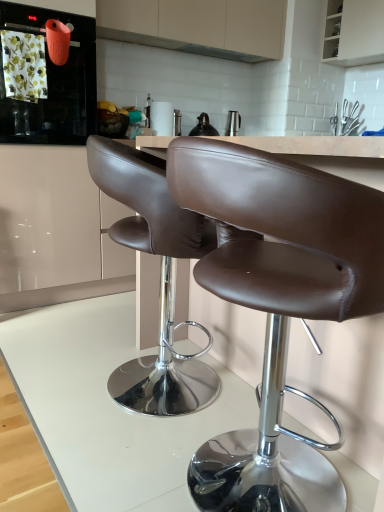
Question: Is brown leather chair at center, the 1th chair from the front, completely or partially inside metallic silver exhaust hood at upper center?

Choices:
 (A) yes
 (B) no

Answer: (B)

Question: From the image's perspective, would you say metallic silver exhaust hood at upper center is positioned over brown leather chair at center, which is counted as the 2th chair, starting from the back?

Choices:
 (A) no
 (B) yes

Answer: (B)

Question: Would you say metallic silver exhaust hood at upper center is outside brown leather chair at center, the 1th chair from the front?

Choices:
 (A) yes
 (B) no

Answer: (A)

Question: Is metallic silver exhaust hood at upper center wider than brown leather chair at center, the 1th chair from the front?

Choices:
 (A) yes
 (B) no

Answer: (B)

Question: Considering the relative positions of metallic silver exhaust hood at upper center and brown leather chair at center, the 1th chair from the front, in the image provided, is metallic silver exhaust hood at upper center to the left of brown leather chair at center, the 1th chair from the front, from the viewer's perspective?

Choices:
 (A) yes
 (B) no

Answer: (B)

Question: Can you confirm if metallic silver exhaust hood at upper center is taller than brown leather chair at center, which is counted as the 2th chair, starting from the back?

Choices:
 (A) yes
 (B) no

Answer: (B)

Question: From a real-world perspective, is brown leather chair at center, which is counted as the 2th chair, starting from the back, over brown leather chair at center, the 1th chair positioned from the back?

Choices:
 (A) no
 (B) yes

Answer: (B)

Question: Is brown leather chair at center, which is counted as the 2th chair, starting from the back, next to brown leather chair at center, the 2th chair positioned from the front?

Choices:
 (A) no
 (B) yes

Answer: (A)

Question: Is brown leather chair at center, the 1th chair from the front, oriented towards brown leather chair at center, the 2th chair positioned from the front?

Choices:
 (A) no
 (B) yes

Answer: (A)

Question: From the image's perspective, is brown leather chair at center, the 1th chair from the front, above brown leather chair at center, the 2th chair positioned from the front?

Choices:
 (A) no
 (B) yes

Answer: (A)

Question: Can you confirm if brown leather chair at center, which is counted as the 2th chair, starting from the back, is smaller than brown leather chair at center, the 2th chair positioned from the front?

Choices:
 (A) no
 (B) yes

Answer: (B)

Question: Can you confirm if brown leather chair at center, which is counted as the 2th chair, starting from the back, is taller than brown leather chair at center, the 2th chair positioned from the front?

Choices:
 (A) no
 (B) yes

Answer: (B)

Question: Is brown leather chair at center, which is counted as the 2th chair, starting from the back, thinner than matte orange kettle at upper left?

Choices:
 (A) yes
 (B) no

Answer: (A)